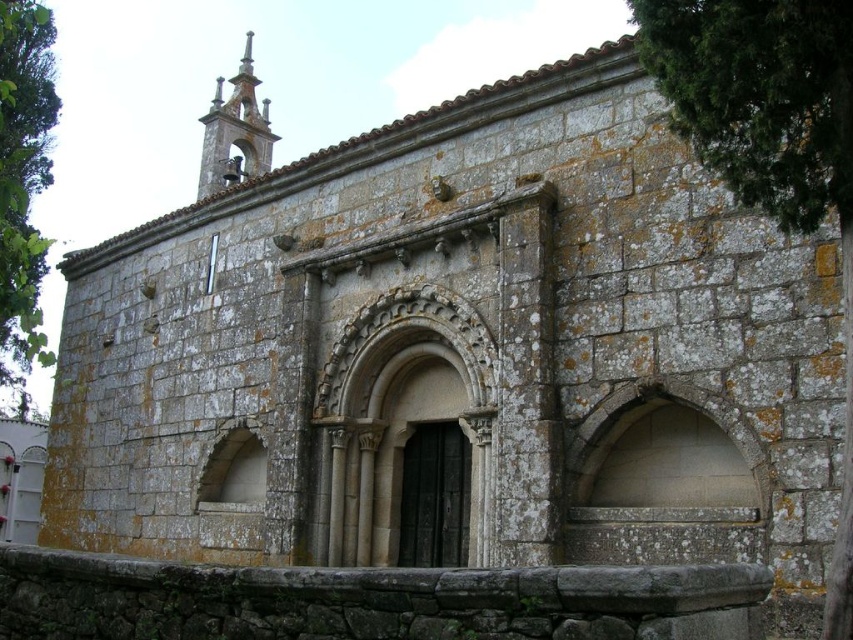
You are an architect examining the ancient stone building. You notice the green mossy stone wall at upper right and the green leafy tree at left. Which of these two elements has a smaller visual presence in the image?

The green mossy stone wall at upper right has a smaller size compared to the green leafy tree at left, so the green mossy stone wall at upper right has a smaller visual presence.

You are standing in front of the ancient stone building and want to take a photo of both the green mossy stone wall at upper right and the green leafy tree at left. Which object should you frame first in your camera to ensure both are visible in the shot?

You should frame the green leafy tree at left first because the green mossy stone wall at upper right is positioned on the right side of it, so by starting with the tree on the left, you can adjust the camera to include both objects in the frame.